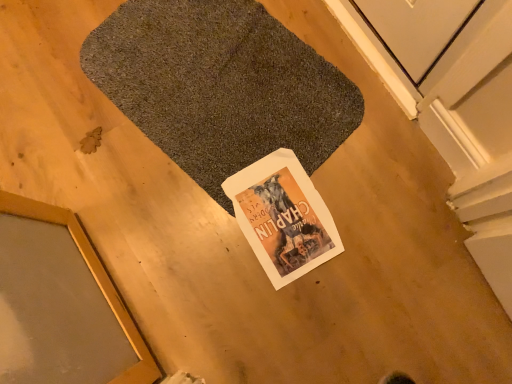
The width and height of the screenshot is (512, 384). What are the coordinates of `free space in front of white paper magazine at center` in the screenshot? It's located at 300,307.